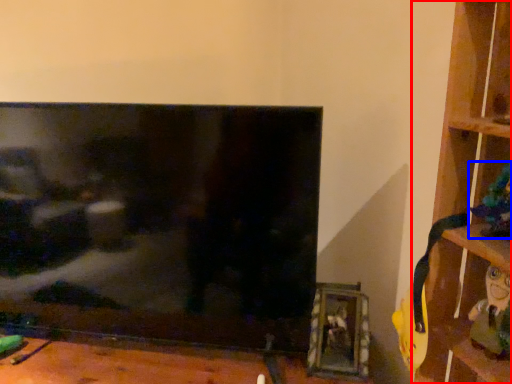
Question: Among these objects, which one is nearest to the camera, shelf (highlighted by a red box) or toy (highlighted by a blue box)?

Choices:
 (A) shelf
 (B) toy

Answer: (A)